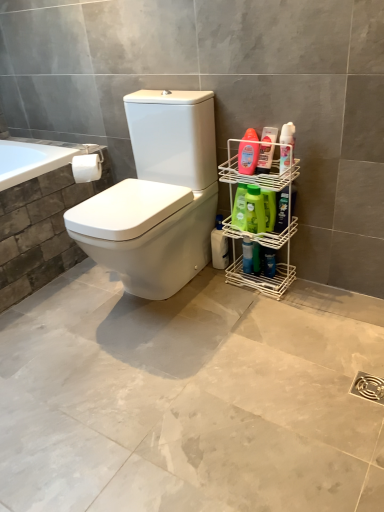
Question: Can you confirm if green matte bottle at center-right, arranged as the third cleaning product when viewed from the back, is positioned to the right of translucent plastic bottle at right, the 7th cleaning product from the back?

Choices:
 (A) no
 (B) yes

Answer: (A)

Question: Is green matte bottle at center-right, arranged as the third cleaning product when viewed from the back, beside translucent plastic bottle at right, positioned as the 2th cleaning product in front-to-back order?

Choices:
 (A) no
 (B) yes

Answer: (A)

Question: From the image's perspective, is green matte bottle at center-right, arranged as the third cleaning product when viewed from the back, above translucent plastic bottle at right, the 7th cleaning product from the back?

Choices:
 (A) no
 (B) yes

Answer: (A)

Question: Is green matte bottle at center-right, acting as the sixth cleaning product starting from the front, further to the viewer compared to translucent plastic bottle at right, the 7th cleaning product from the back?

Choices:
 (A) no
 (B) yes

Answer: (B)

Question: Could translucent plastic bottle at right, positioned as the 2th cleaning product in front-to-back order, be considered to be inside green matte bottle at center-right, arranged as the third cleaning product when viewed from the back?

Choices:
 (A) no
 (B) yes

Answer: (A)

Question: Is green matte bottle at center-right, acting as the sixth cleaning product starting from the front, located outside translucent plastic bottle at right, the 7th cleaning product from the back?

Choices:
 (A) yes
 (B) no

Answer: (A)

Question: From the image's perspective, is translucent plastic bottle at right, which is the 6th cleaning product from back to front, under white matte toilet paper at upper left?

Choices:
 (A) no
 (B) yes

Answer: (A)

Question: Is translucent plastic bottle at right, which is the 6th cleaning product from back to front, oriented towards white matte toilet paper at upper left?

Choices:
 (A) yes
 (B) no

Answer: (B)

Question: Does translucent plastic bottle at right, which is the 6th cleaning product from back to front, have a smaller size compared to white matte toilet paper at upper left?

Choices:
 (A) no
 (B) yes

Answer: (B)

Question: Considering the relative sizes of translucent plastic bottle at right, which is the 6th cleaning product from back to front, and white matte toilet paper at upper left in the image provided, is translucent plastic bottle at right, which is the 6th cleaning product from back to front, bigger than white matte toilet paper at upper left?

Choices:
 (A) no
 (B) yes

Answer: (A)

Question: From a real-world perspective, does translucent plastic bottle at right, arranged as the 3th cleaning product when viewed from the front, sit lower than white matte toilet paper at upper left?

Choices:
 (A) yes
 (B) no

Answer: (B)

Question: Considering the relative positions of translucent plastic bottle at right, arranged as the 3th cleaning product when viewed from the front, and white matte toilet paper at upper left in the image provided, is translucent plastic bottle at right, arranged as the 3th cleaning product when viewed from the front, to the right of white matte toilet paper at upper left from the viewer's perspective?

Choices:
 (A) no
 (B) yes

Answer: (B)

Question: Is green matte bottle at right, which is counted as the fourth cleaning product, starting from the back, to the left of blue glossy spray bottle at right, positioned as the first cleaning product in back-to-front order, from the viewer's perspective?

Choices:
 (A) no
 (B) yes

Answer: (A)